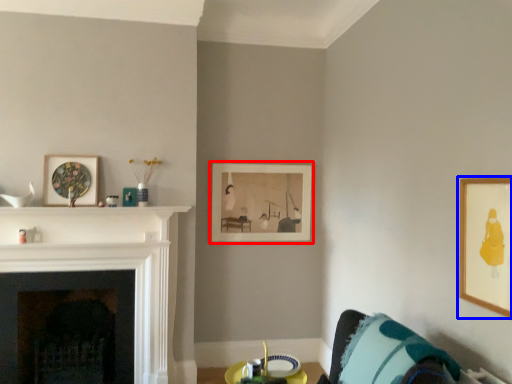
Question: Which point is further to the camera, picture frame (highlighted by a red box) or picture frame (highlighted by a blue box)?

Choices:
 (A) picture frame
 (B) picture frame

Answer: (A)